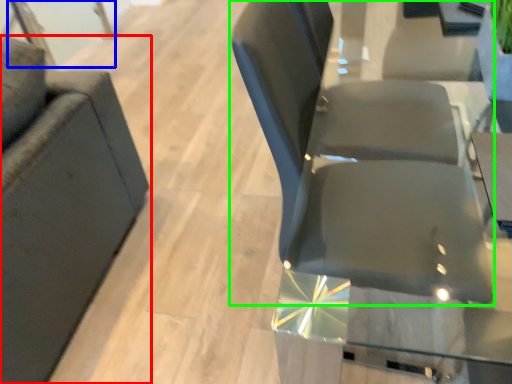
Question: Which is farther away from chair (highlighted by a red box)? glass door (highlighted by a blue box) or chair (highlighted by a green box)?

Choices:
 (A) glass door
 (B) chair

Answer: (A)